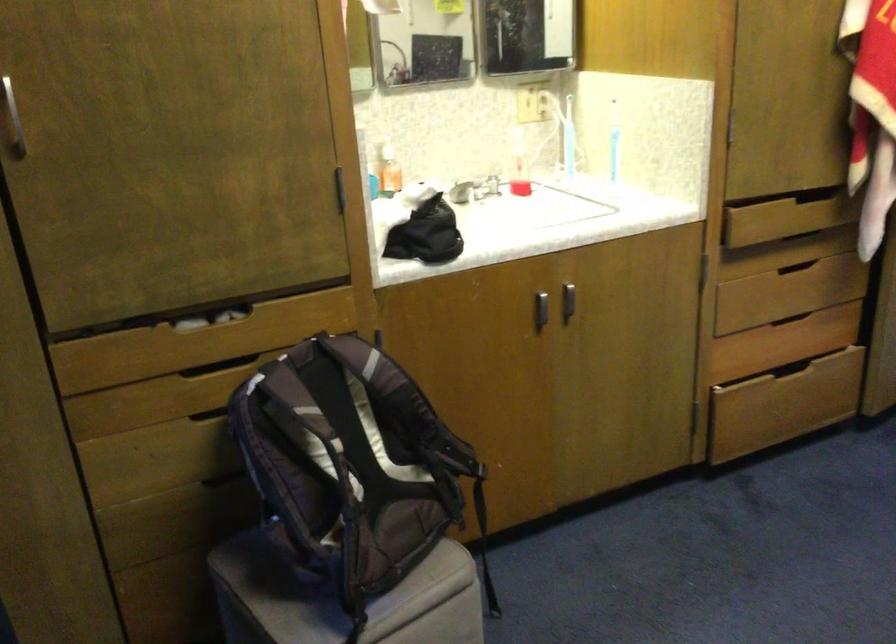
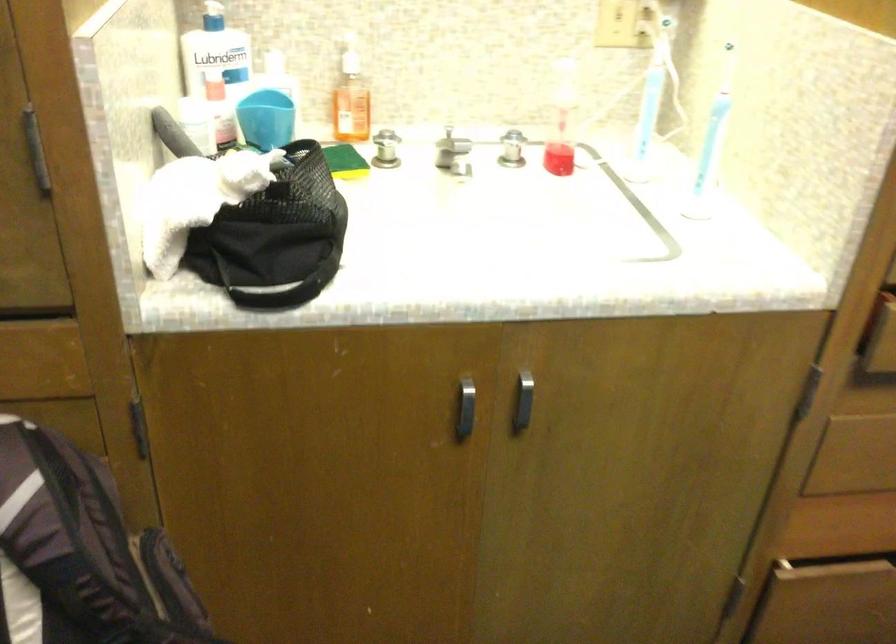
The point at [495,184] is marked in the first image. Where is the corresponding point in the second image?

(512, 149)